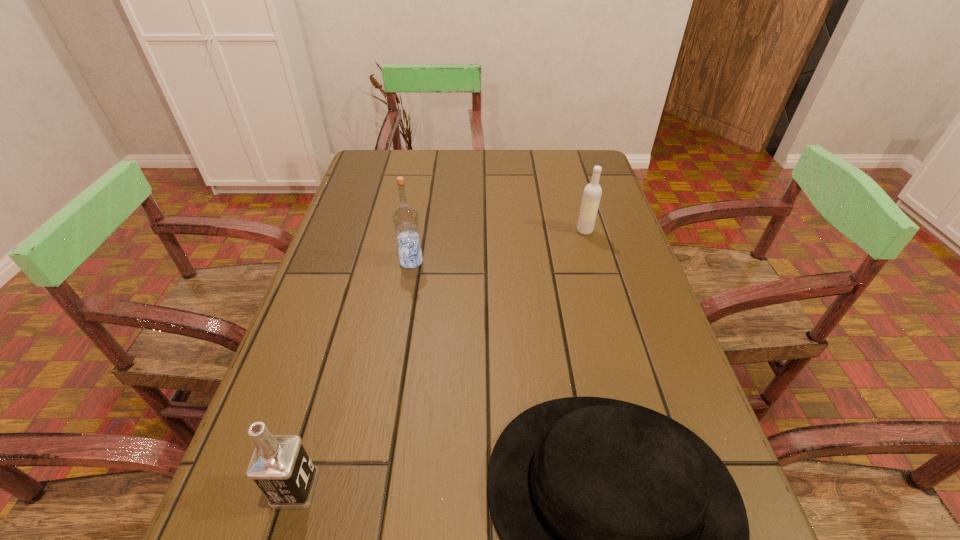
I want to click on object that is at the right edge, so click(592, 193).

The height and width of the screenshot is (540, 960). I want to click on free space at the far edge, so click(x=426, y=167).

The image size is (960, 540). Identify the location of free space at the left edge. (348, 253).

Find the location of `blank space at the right edge of the desktop`. blank space at the right edge of the desktop is located at coordinates (700, 407).

You are a GUI agent. You are given a task and a screenshot of the screen. Output one action in this format:
    pyautogui.click(x=<x>, y=<y>)
    Task: Click on the free space at the far right corner of the desktop
    This screenshot has height=540, width=960.
    Given the screenshot: What is the action you would take?
    (x=582, y=178)

Find the location of a particular element. The height and width of the screenshot is (540, 960). free point between the third nearest object and the farthest vodka is located at coordinates (498, 246).

The height and width of the screenshot is (540, 960). In order to click on free space between the farthest vodka and the tallest object in this screenshot , I will do `click(498, 246)`.

Locate an element on the screen. Image resolution: width=960 pixels, height=540 pixels. empty space that is in between the nearest vodka and the rightmost vodka is located at coordinates (441, 360).

Image resolution: width=960 pixels, height=540 pixels. Identify the location of the closest object to the leftmost vodka. (625, 539).

Locate which object is the second closest to the rightmost vodka. Please provide its 2D coordinates. Your answer should be formatted as a tuple, i.e. [(x, y)], where the tuple contains the x and y coordinates of a point satisfying the conditions above.

[(625, 539)]